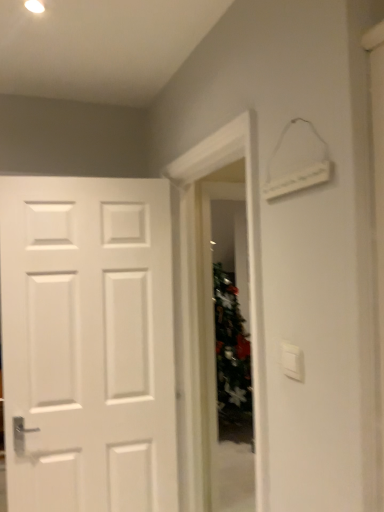
In order to click on white plastic light switch at upper right in this screenshot , I will do `click(292, 361)`.

What is the approximate height of white plastic light switch at upper right?

It is 3.60 inches.

Describe the element at coordinates (292, 361) in the screenshot. Image resolution: width=384 pixels, height=512 pixels. I see `white plastic light switch at upper right` at that location.

This screenshot has height=512, width=384. What do you see at coordinates (225, 349) in the screenshot? I see `green frosted glass door at center` at bounding box center [225, 349].

You are a GUI agent. You are given a task and a screenshot of the screen. Output one action in this format:
    pyautogui.click(x=<x>, y=<y>)
    Task: Click on the green frosted glass door at center
    
    Given the screenshot: What is the action you would take?
    tap(225, 349)

Where is `white plastic light switch at upper right`? white plastic light switch at upper right is located at coordinates (292, 361).

Which is more to the right, green frosted glass door at center or white plastic light switch at upper right?

white plastic light switch at upper right is more to the right.

Is the depth of green frosted glass door at center greater than that of white plastic light switch at upper right?

That is True.

Considering the positions of points (216, 296) and (281, 355), is point (216, 296) closer to camera compared to point (281, 355)?

No.

From the image's perspective, does green frosted glass door at center appear lower than white plastic light switch at upper right?

Yes, from the image's perspective, green frosted glass door at center is below white plastic light switch at upper right.

From a real-world perspective, is green frosted glass door at center physically located above or below white plastic light switch at upper right?

Clearly, from a real-world perspective, green frosted glass door at center is below white plastic light switch at upper right.

Considering the sizes of objects green frosted glass door at center and white plastic light switch at upper right in the image provided, who is wider, green frosted glass door at center or white plastic light switch at upper right?

green frosted glass door at center is wider.

Between green frosted glass door at center and white plastic light switch at upper right, which one has less height?

white plastic light switch at upper right.

Is green frosted glass door at center bigger or smaller than white plastic light switch at upper right?

Clearly, green frosted glass door at center is larger in size than white plastic light switch at upper right.

Can we say green frosted glass door at center lies outside white plastic light switch at upper right?

That's correct, green frosted glass door at center is outside of white plastic light switch at upper right.

Can you see green frosted glass door at center touching white plastic light switch at upper right?

They are not placed beside each other.

Is green frosted glass door at center facing towards white plastic light switch at upper right?

No, green frosted glass door at center does not turn towards white plastic light switch at upper right.

How different are the orientations of green frosted glass door at center and white plastic light switch at upper right in degrees?

They differ by 92.9 degrees in their facing directions.

Measure the distance from green frosted glass door at center to white plastic light switch at upper right.

They are 7.34 feet apart.

The height and width of the screenshot is (512, 384). I want to click on glass door below the white plastic light switch at upper right (from a real-world perspective), so click(225, 349).

Between white plastic light switch at upper right and green frosted glass door at center, which one appears on the left side from the viewer's perspective?

green frosted glass door at center.

Based on the photo, does white plastic light switch at upper right come in front of green frosted glass door at center?

Yes.

Considering the positions of point (298, 377) and point (218, 207), is point (298, 377) closer or farther from the camera than point (218, 207)?

Point (298, 377) is closer to the camera than point (218, 207).

From the image's perspective, is white plastic light switch at upper right located above or below green frosted glass door at center?

Clearly, from the image's perspective, white plastic light switch at upper right is above green frosted glass door at center.

From a real-world perspective, between white plastic light switch at upper right and green frosted glass door at center, who is vertically higher?

white plastic light switch at upper right.

Looking at this image, which of these two, white plastic light switch at upper right or green frosted glass door at center, is thinner?

Thinner between the two is white plastic light switch at upper right.

Is white plastic light switch at upper right taller than green frosted glass door at center?

Incorrect, the height of white plastic light switch at upper right is not larger of that of green frosted glass door at center.

Consider the image. Between white plastic light switch at upper right and green frosted glass door at center, which one has larger size?

green frosted glass door at center.

Is white plastic light switch at upper right inside the boundaries of green frosted glass door at center, or outside?

white plastic light switch at upper right lies outside green frosted glass door at center.

Would you consider white plastic light switch at upper right to be distant from green frosted glass door at center?

Yes.

Could you tell me if white plastic light switch at upper right is facing green frosted glass door at center?

No.

What's the angular difference between white plastic light switch at upper right and green frosted glass door at center's facing directions?

There is a 92.9-degree angle between the facing directions of white plastic light switch at upper right and green frosted glass door at center.

Image resolution: width=384 pixels, height=512 pixels. I want to click on glass door located below the white plastic light switch at upper right (from the image's perspective), so click(x=225, y=349).

This screenshot has height=512, width=384. Find the location of `light switch above the green frosted glass door at center (from a real-world perspective)`. light switch above the green frosted glass door at center (from a real-world perspective) is located at coordinates (292, 361).

Locate an element on the screen. The height and width of the screenshot is (512, 384). light switch in front of the green frosted glass door at center is located at coordinates (292, 361).